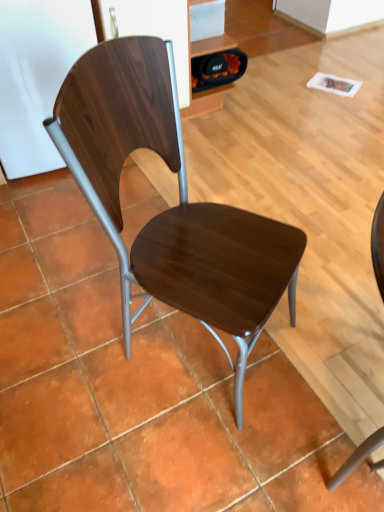
At what (x,y) coordinates should I click in order to perform the action: click on vacant area located to the right-hand side of shiny dark wood chair at center. Please return your answer as a coordinate pair (x, y). This screenshot has height=512, width=384. Looking at the image, I should click on pos(324,308).